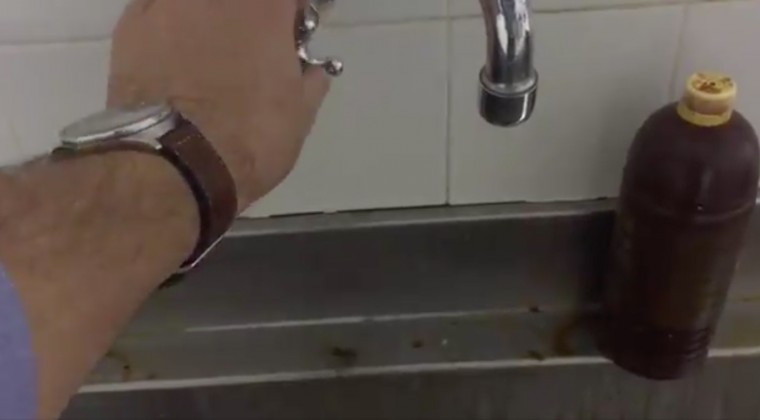
You are a GUI agent. You are given a task and a screenshot of the screen. Output one action in this format:
    pyautogui.click(x=<x>, y=<y>)
    Task: Click on the bottle
    This screenshot has width=760, height=420.
    Given the screenshot: What is the action you would take?
    [660, 242]